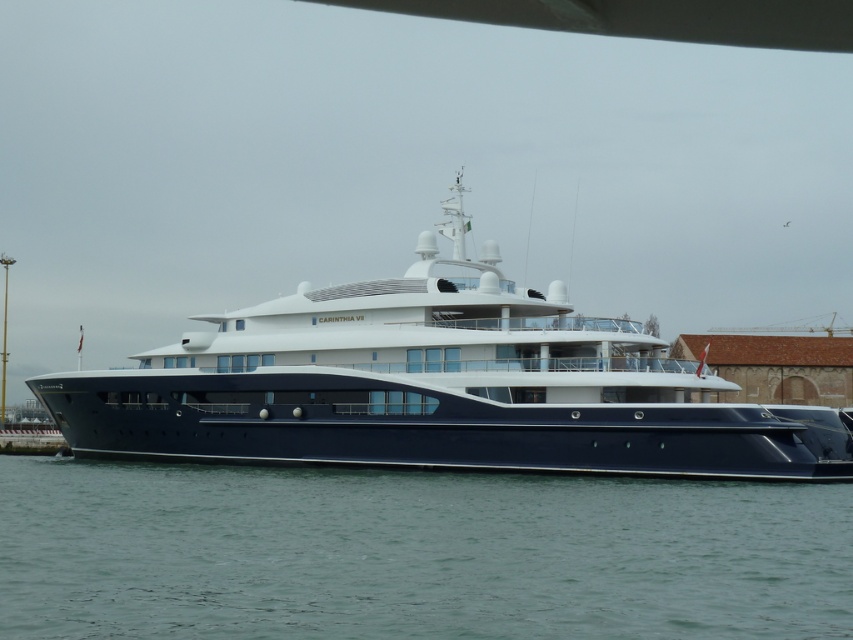
You are a photographer planning to capture the shiny blue yacht at center from the green water at lower center. Considering the spatial relationship between them, which object would appear wider in the photo?

The shiny blue yacht at center would appear wider in the photo since it has a greater width than the green water at lower center according to the description.

Consider the image. You are standing on the deck of the shiny blue yacht at center and want to look at the green water at lower center. In which direction should you turn to see it?

The green water at lower center is positioned on the right side of the shiny blue yacht at center, so you should turn to your right to see it.